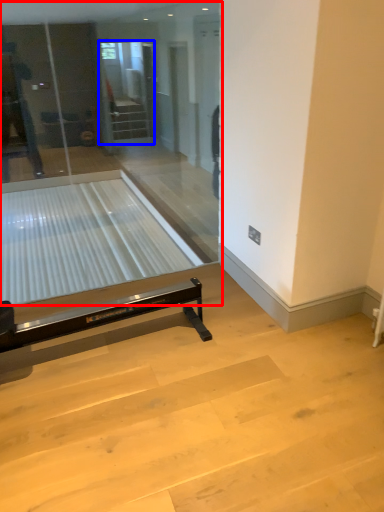
Question: Among these objects, which one is farthest to the camera, glass door (highlighted by a red box) or screen door (highlighted by a blue box)?

Choices:
 (A) glass door
 (B) screen door

Answer: (B)